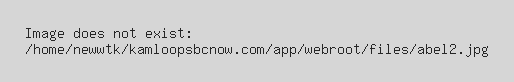
Identify the location of file folder. The height and width of the screenshot is (82, 514). (390, 51).